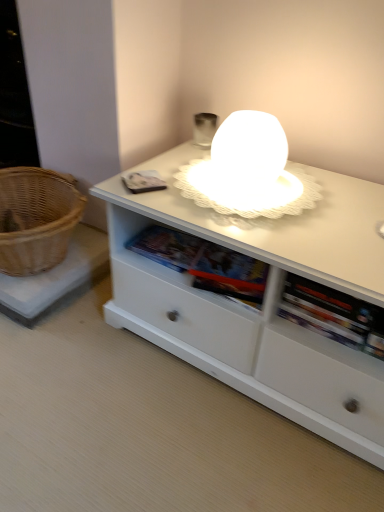
Question: Which is correct: white matte cabinet at center is inside woven brown basket at left, or outside of it?

Choices:
 (A) inside
 (B) outside

Answer: (B)

Question: Is point (180, 346) closer or farther from the camera than point (64, 207)?

Choices:
 (A) farther
 (B) closer

Answer: (B)

Question: Looking at their shapes, would you say white matte cabinet at center is wider or thinner than woven brown basket at left?

Choices:
 (A) wide
 (B) thin

Answer: (A)

Question: From a real-world perspective, relative to white matte cabinet at center, is woven brown basket at left vertically above or below?

Choices:
 (A) below
 (B) above

Answer: (B)

Question: Is woven brown basket at left situated inside white matte cabinet at center or outside?

Choices:
 (A) inside
 (B) outside

Answer: (B)

Question: Considering the relative positions of woven brown basket at left and white matte cabinet at center in the image provided, is woven brown basket at left to the left or to the right of white matte cabinet at center?

Choices:
 (A) right
 (B) left

Answer: (B)

Question: From the image's perspective, is woven brown basket at left located above or below white matte cabinet at center?

Choices:
 (A) below
 (B) above

Answer: (B)